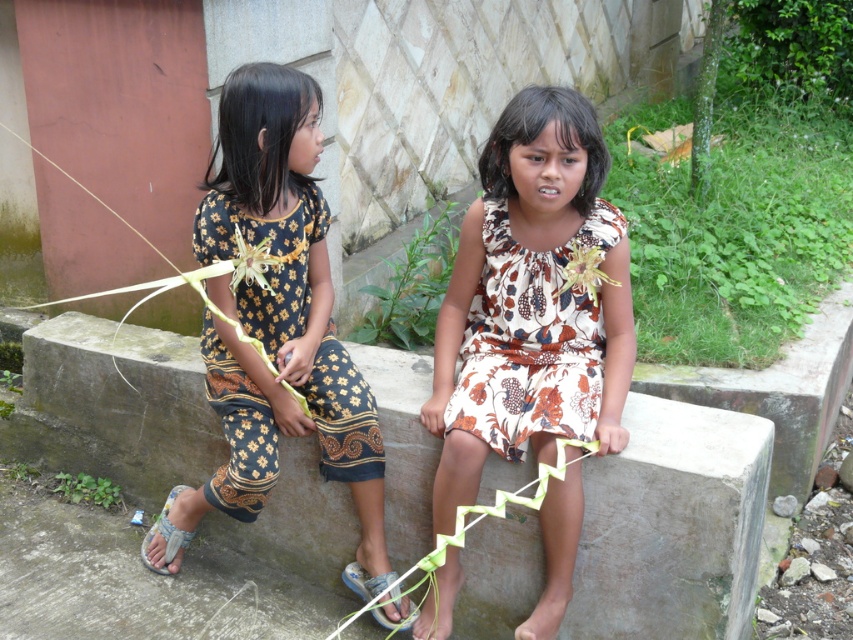
Can you confirm if dark blue batik dress at left is positioned to the right of blue fabric sandal at lower center?

Incorrect, dark blue batik dress at left is not on the right side of blue fabric sandal at lower center.

Which of these two, dark blue batik dress at left or blue fabric sandal at lower center, stands taller?

With more height is dark blue batik dress at left.

Locate an element on the screen. This screenshot has width=853, height=640. dark blue batik dress at left is located at coordinates (277, 310).

Who is more forward, (186,496) or (144,554)?

Point (186,496) is in front.

Can you confirm if dark blue batik dress at left is wider than gray fabric sandal at lower left?

Yes.

At what (x,y) coordinates should I click in order to perform the action: click on dark blue batik dress at left. Please return your answer as a coordinate pair (x, y). The height and width of the screenshot is (640, 853). Looking at the image, I should click on (277, 310).

At what (x,y) coordinates should I click in order to perform the action: click on dark blue batik dress at left. Please return your answer as a coordinate pair (x, y). Looking at the image, I should click on (277, 310).

Is point (527, 138) behind point (376, 608)?

That is False.

Which is more to the left, printed fabric dress at center or blue fabric sandal at lower center?

blue fabric sandal at lower center

Image resolution: width=853 pixels, height=640 pixels. I want to click on printed fabric dress at center, so click(532, 301).